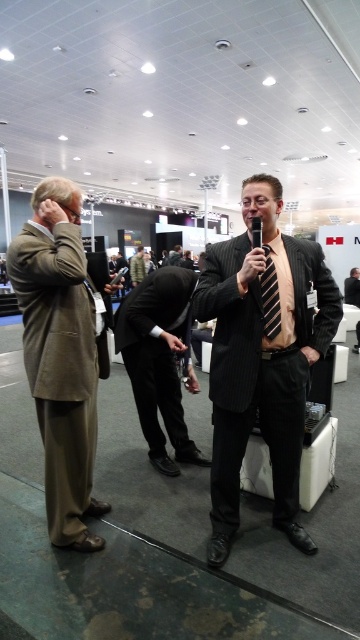
How much distance is there between matte brown suit at left and khaki cotton suit at center?

A distance of 9.71 meters exists between matte brown suit at left and khaki cotton suit at center.

Between matte brown suit at left and khaki cotton suit at center, which one appears on the left side from the viewer's perspective?

khaki cotton suit at center is more to the left.

Find the location of `matte brown suit at left`. matte brown suit at left is located at coordinates [x=60, y=355].

Is striped fabric suit at center bigger than black striped tie at center?

Yes, striped fabric suit at center is bigger than black striped tie at center.

The width and height of the screenshot is (360, 640). I want to click on striped fabric suit at center, so click(x=262, y=358).

Does point (227, 403) lie in front of point (273, 321)?

No.

Image resolution: width=360 pixels, height=640 pixels. Find the location of `striped fabric suit at center`. striped fabric suit at center is located at coordinates (262, 358).

What do you see at coordinates (159, 360) in the screenshot? I see `black pinstripe suit at center` at bounding box center [159, 360].

Which is more to the left, black pinstripe suit at center or black striped tie at center?

From the viewer's perspective, black pinstripe suit at center appears more on the left side.

The image size is (360, 640). I want to click on black pinstripe suit at center, so click(159, 360).

This screenshot has width=360, height=640. What are the coordinates of `black pinstripe suit at center` in the screenshot? It's located at (159, 360).